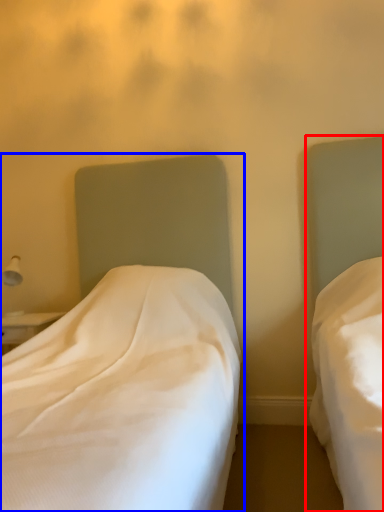
Question: Among these objects, which one is nearest to the camera, bed (highlighted by a red box) or bed (highlighted by a blue box)?

Choices:
 (A) bed
 (B) bed

Answer: (A)